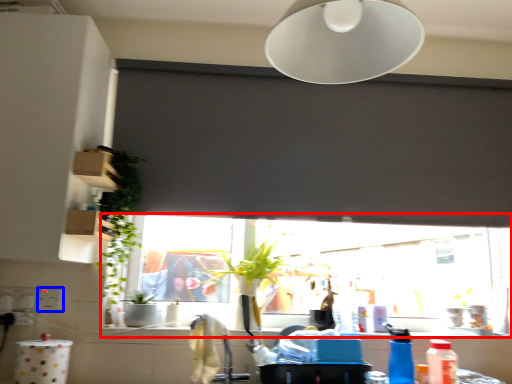
Question: Which point is further to the camera, window (highlighted by a red box) or electric outlet (highlighted by a blue box)?

Choices:
 (A) window
 (B) electric outlet

Answer: (A)